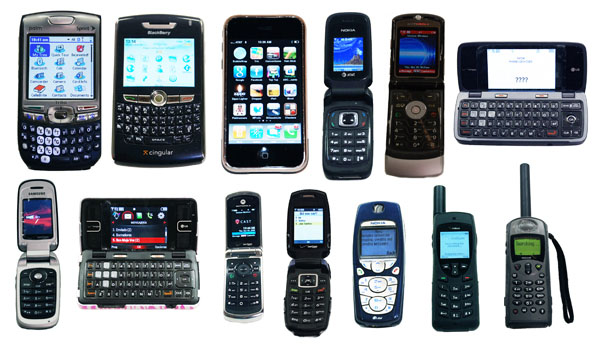
Find the location of a particular element. The width and height of the screenshot is (600, 345). conventional phone is located at coordinates (447, 293), (524, 292), (462, 246), (525, 247).